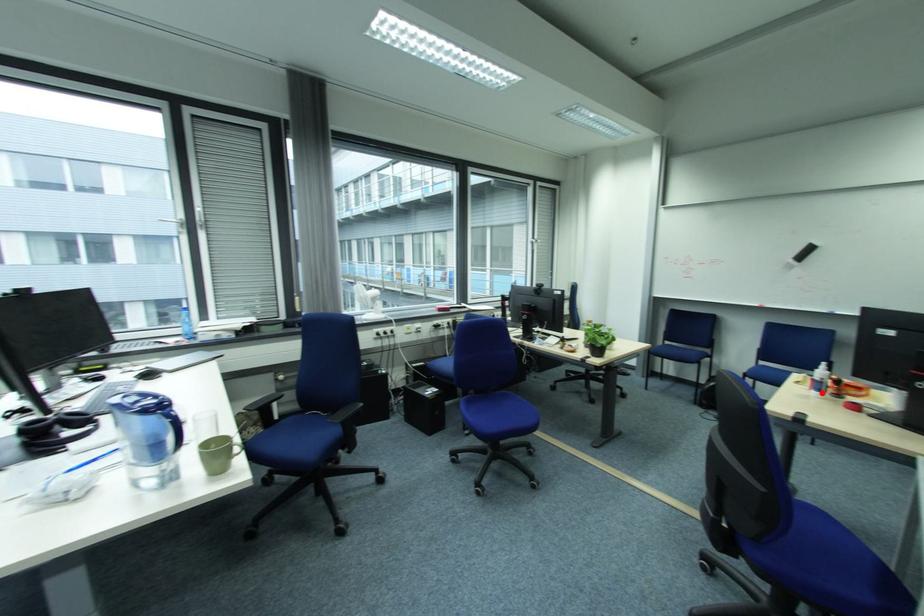
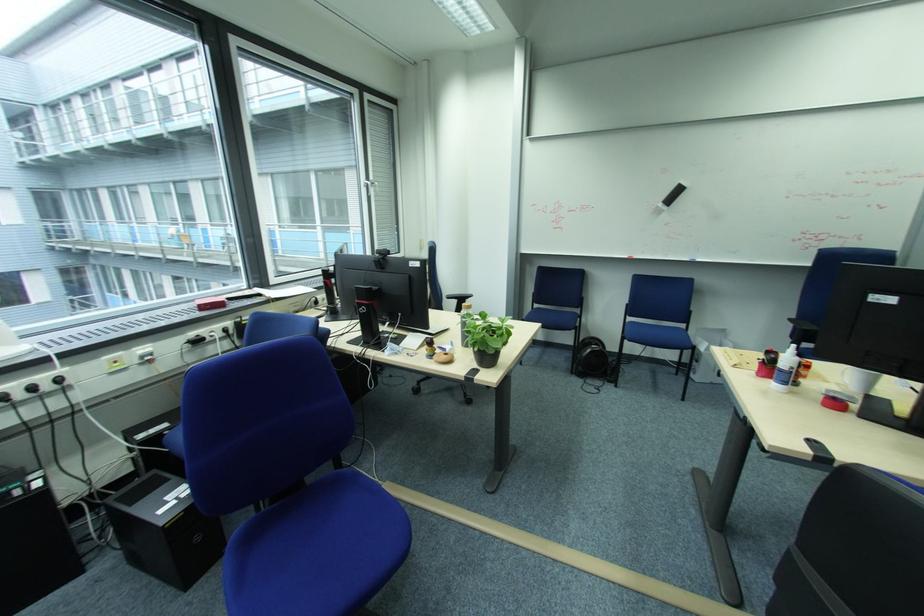
The point at the highlighted location is marked in the first image. Where is the corresponding point in the second image?

(784, 387)